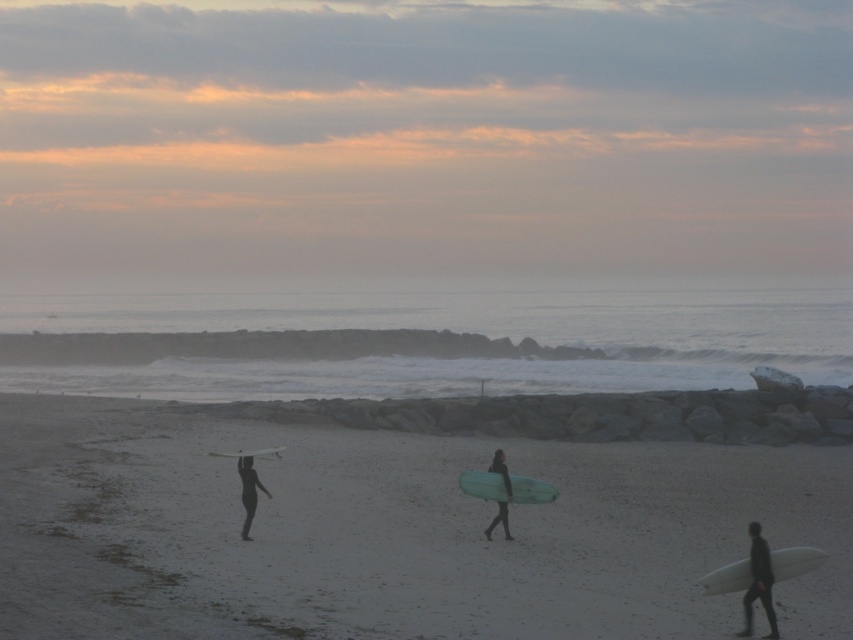
From the picture: Who is taller, dark matte wetsuit at lower right or black wetsuit at lower left?

black wetsuit at lower left is taller.

Based on the photo, is dark matte wetsuit at lower right to the left of black wetsuit at lower left from the viewer's perspective?

Incorrect, dark matte wetsuit at lower right is not on the left side of black wetsuit at lower left.

Which is behind, point (769, 624) or point (254, 492)?

Positioned behind is point (254, 492).

Where is `dark matte wetsuit at lower right`? dark matte wetsuit at lower right is located at coordinates (758, 582).

Can you confirm if white sand at center is positioned above black wetsuit at lower left?

Actually, white sand at center is below black wetsuit at lower left.

Who is more distant from viewer, (461, 563) or (245, 540)?

The point (245, 540) is more distant.

Find the location of a particular element. white sand at center is located at coordinates (392, 532).

Which is more to the left, white matte surfboard at lower right or black wetsuit at lower left?

black wetsuit at lower left

Describe the element at coordinates (793, 561) in the screenshot. I see `white matte surfboard at lower right` at that location.

Is point (793, 547) less distant than point (241, 488)?

No, it is not.

Image resolution: width=853 pixels, height=640 pixels. Find the location of `white matte surfboard at lower right`. white matte surfboard at lower right is located at coordinates coord(793,561).